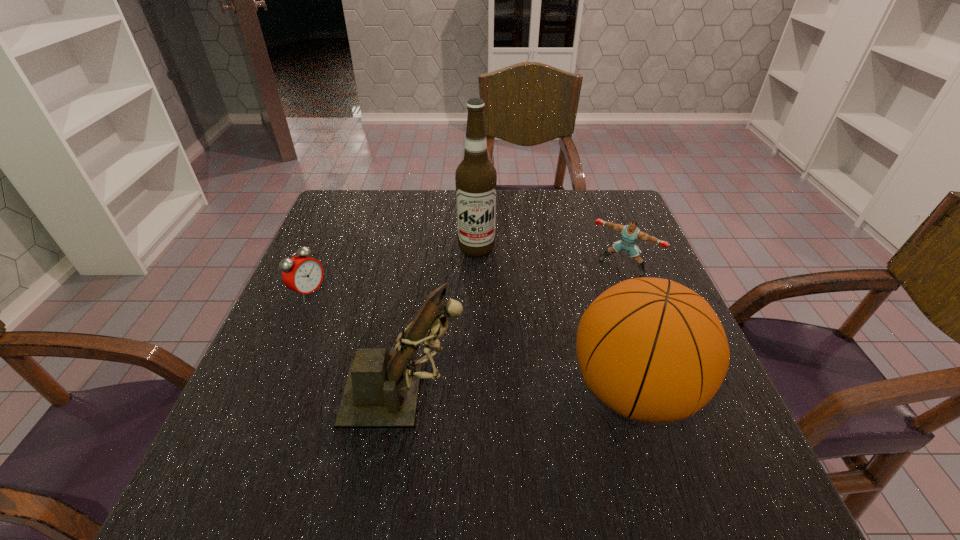
What are the coordinates of `figurine` in the screenshot? It's located at (381, 391).

Find the location of a particular element. This screenshot has width=960, height=540. basketball is located at coordinates (653, 350).

Identify the location of alarm clock. The image size is (960, 540). (302, 274).

This screenshot has width=960, height=540. I want to click on the shortest object, so click(302, 274).

You are a GUI agent. You are given a task and a screenshot of the screen. Output one action in this format:
    pyautogui.click(x=<x>, y=<y>)
    Task: Click on the tallest object
    The width and height of the screenshot is (960, 540).
    Given the screenshot: What is the action you would take?
    pyautogui.click(x=476, y=177)

Where is `puncher`? The width and height of the screenshot is (960, 540). puncher is located at coordinates (630, 233).

Find the location of `vacant space located on the front-facing side of the figurine`. vacant space located on the front-facing side of the figurine is located at coordinates (619, 393).

The height and width of the screenshot is (540, 960). What are the coordinates of `free space located on the left of the basketball` in the screenshot? It's located at coord(427,390).

Locate an element on the screen. The width and height of the screenshot is (960, 540). free region located on the front-facing side of the alarm clock is located at coordinates (x=428, y=352).

Where is `vacant space located 0.150m on the front-facing side of the alarm clock`? vacant space located 0.150m on the front-facing side of the alarm clock is located at coordinates (370, 323).